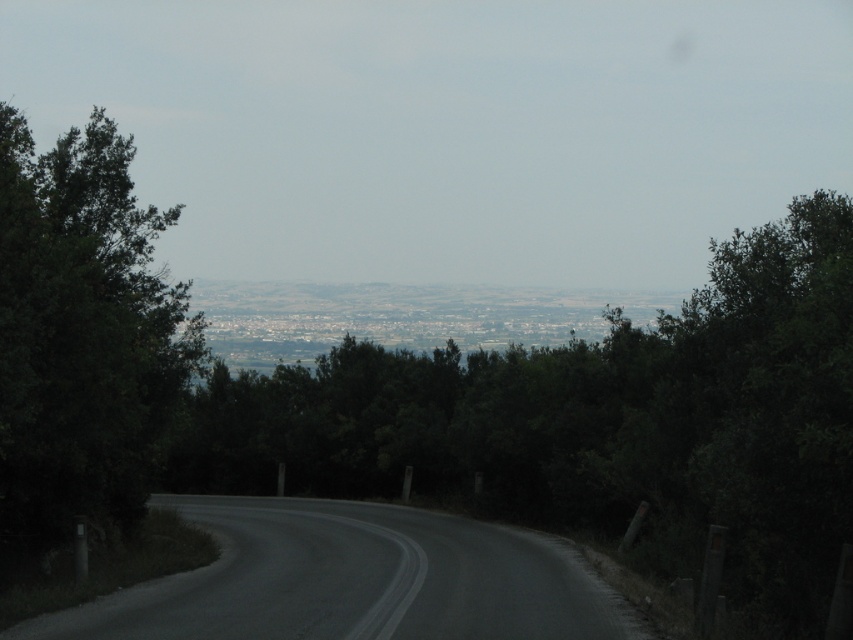
Question: Which point is closer to the camera?

Choices:
 (A) (175, 385)
 (B) (546, 426)

Answer: (A)

Question: Which object is the farthest from the green leafy tree at left?

Choices:
 (A) green leafy tree at center
 (B) dark asphalt road at center

Answer: (A)

Question: Does green leafy tree at center have a greater width compared to green leafy tree at left?

Choices:
 (A) no
 (B) yes

Answer: (B)

Question: Which object is positioned farthest from the green leafy tree at center?

Choices:
 (A) dark asphalt road at center
 (B) green leafy tree at left

Answer: (B)

Question: Is green leafy tree at center further to the viewer compared to green leafy tree at left?

Choices:
 (A) yes
 (B) no

Answer: (B)

Question: Observing the image, what is the correct spatial positioning of green leafy tree at left in reference to dark asphalt road at center?

Choices:
 (A) left
 (B) right

Answer: (A)